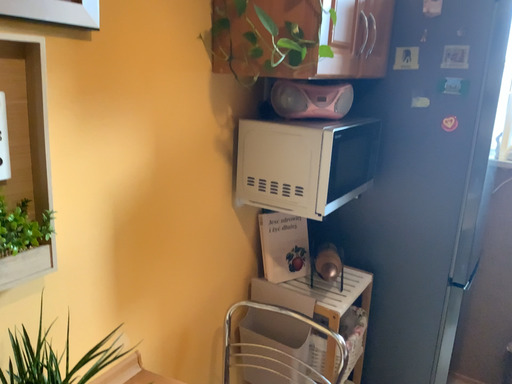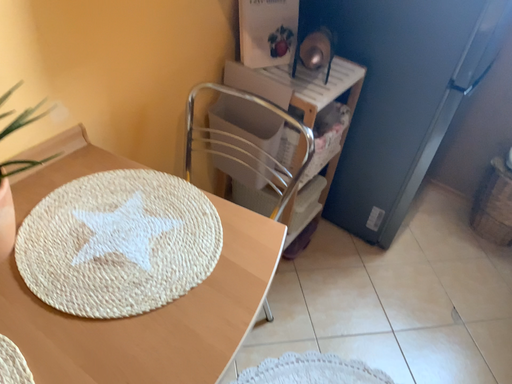
Question: How did the camera likely rotate when shooting the video?

Choices:
 (A) rotated downward
 (B) rotated upward

Answer: (A)